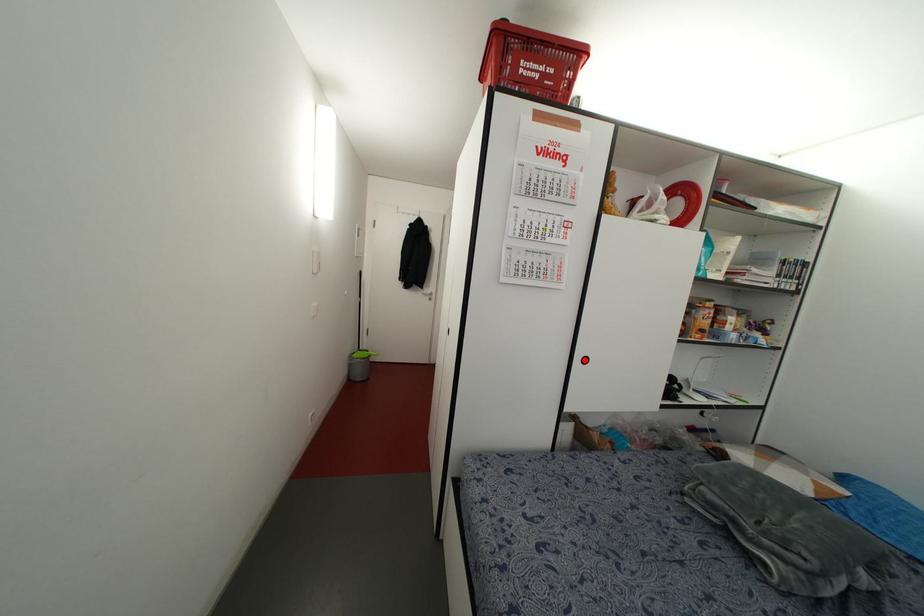
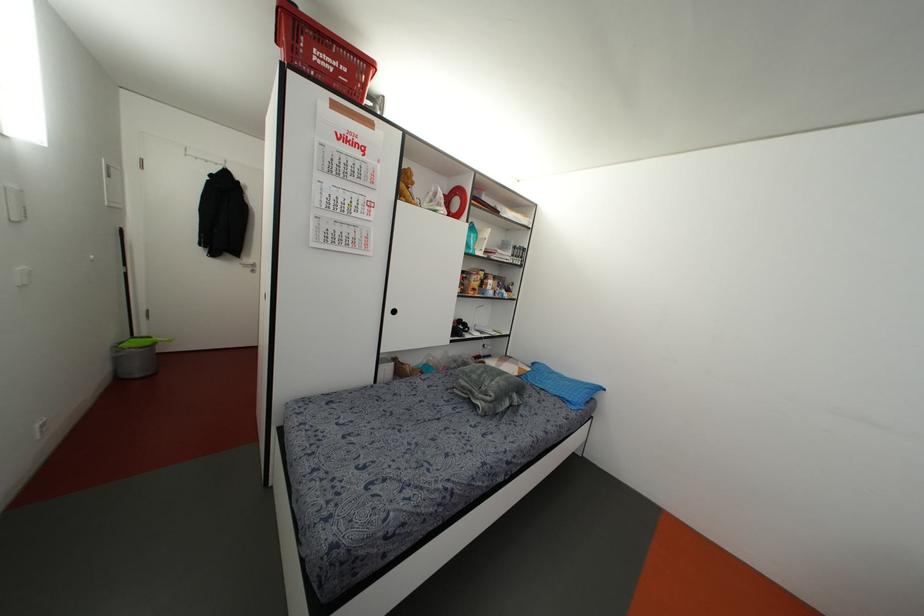
Where in the second image is the point corresponding to the highlighted location from the first image?

(394, 310)